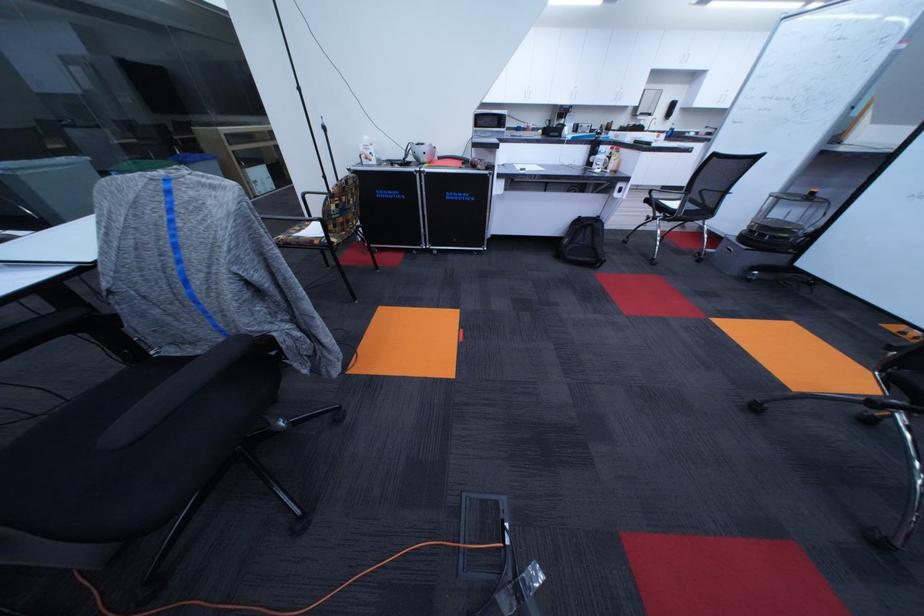
This screenshot has width=924, height=616. What do you see at coordinates (623, 65) in the screenshot?
I see `a white cabinet handle` at bounding box center [623, 65].